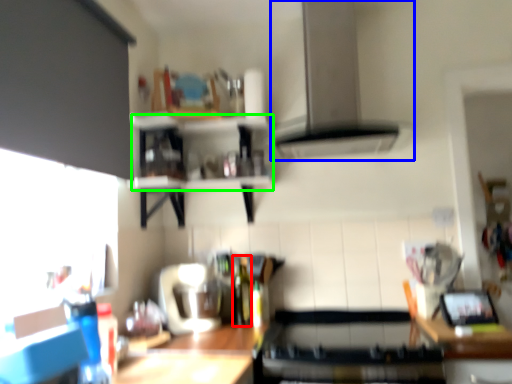
Question: Which object is the closest to the bottle (highlighted by a red box)? Choose among these: exhaust hood (highlighted by a blue box) or shelf (highlighted by a green box).

Choices:
 (A) exhaust hood
 (B) shelf

Answer: (B)